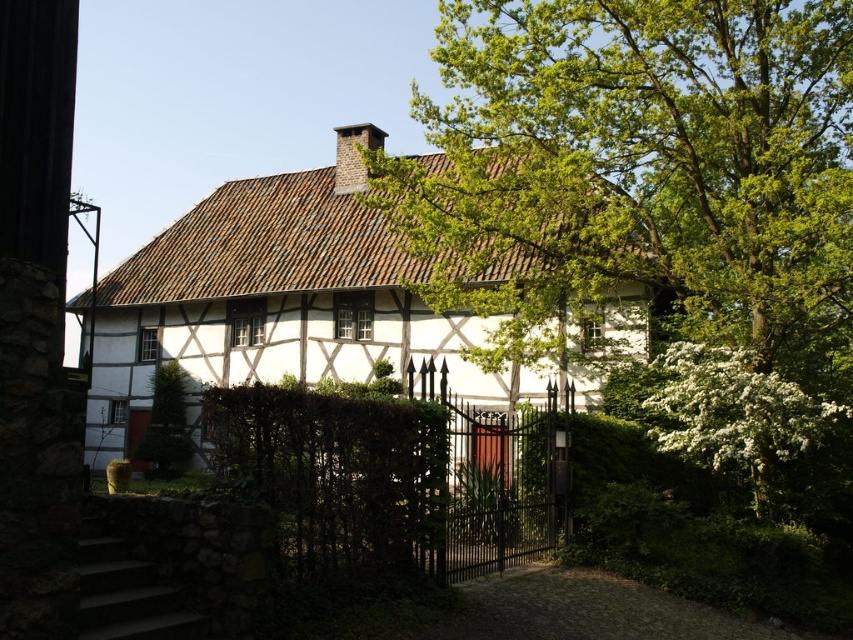
Question: Which point appears closest to the camera in this image?

Choices:
 (A) (376, 356)
 (B) (786, 67)

Answer: (B)

Question: In this image, where is green leafy tree at upper right located relative to dark gray brick chimney at upper center?

Choices:
 (A) left
 (B) right

Answer: (B)

Question: Which point is closer to the camera?

Choices:
 (A) green leafy tree at upper right
 (B) white wooden cottage at center
 (C) dark gray brick chimney at upper center
 (D) brown wooden door at center

Answer: (D)

Question: Is white wooden cottage at center wider than brown wooden door at center?

Choices:
 (A) yes
 (B) no

Answer: (A)

Question: Does brown wooden door at center have a smaller size compared to brown wooden door at lower left?

Choices:
 (A) yes
 (B) no

Answer: (B)

Question: Which object appears closest to the camera in this image?

Choices:
 (A) dark gray brick chimney at upper center
 (B) green leafy tree at upper right
 (C) brown wooden door at center

Answer: (C)